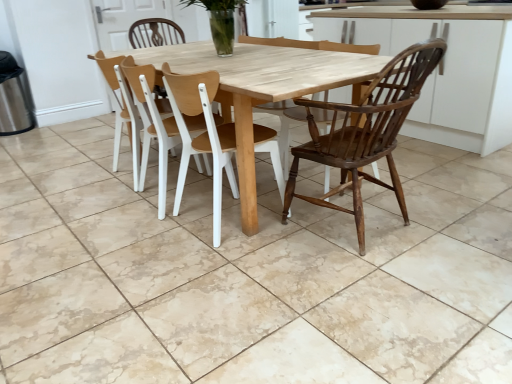
The width and height of the screenshot is (512, 384). In order to click on free space on the front side of dark brown wood chair at right, marked as the third chair in a left-to-right arrangement in this screenshot , I will do `click(378, 290)`.